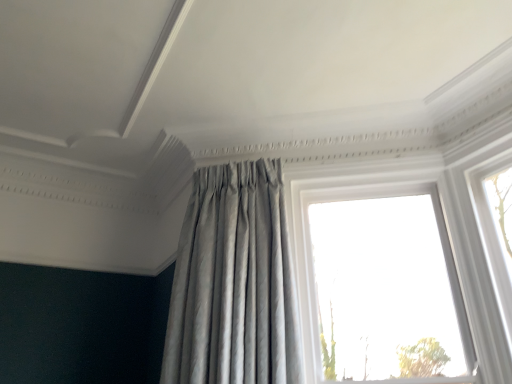
At what (x,y) coordinates should I click in order to perform the action: click on satin silver curtain at center. Please return your answer as a coordinate pair (x, y). The image size is (512, 384). Looking at the image, I should click on 234,283.

Describe the element at coordinates (234, 283) in the screenshot. I see `satin silver curtain at center` at that location.

The width and height of the screenshot is (512, 384). What do you see at coordinates (359, 273) in the screenshot?
I see `transparent glass window at upper right` at bounding box center [359, 273].

At what (x,y) coordinates should I click in order to perform the action: click on transparent glass window at upper right. Please return your answer as a coordinate pair (x, y). Looking at the image, I should click on (359, 273).

Where is `satin silver curtain at center`? The width and height of the screenshot is (512, 384). satin silver curtain at center is located at coordinates (234, 283).

Which is more to the right, transparent glass window at upper right or satin silver curtain at center?

transparent glass window at upper right.

Is transparent glass window at upper right positioned behind satin silver curtain at center?

Yes, transparent glass window at upper right is behind satin silver curtain at center.

Which is in front, point (403, 225) or point (208, 263)?

The point (208, 263) is in front.

From the image's perspective, which is above, transparent glass window at upper right or satin silver curtain at center?

satin silver curtain at center, from the image's perspective.

From a real-world perspective, is transparent glass window at upper right physically below satin silver curtain at center?

Yes, from a real-world perspective, transparent glass window at upper right is beneath satin silver curtain at center.

Between transparent glass window at upper right and satin silver curtain at center, which one has smaller width?

transparent glass window at upper right is thinner.

Considering the sizes of objects transparent glass window at upper right and satin silver curtain at center in the image provided, who is taller, transparent glass window at upper right or satin silver curtain at center?

Standing taller between the two is transparent glass window at upper right.

Can you confirm if transparent glass window at upper right is smaller than satin silver curtain at center?

Yes, transparent glass window at upper right is smaller than satin silver curtain at center.

Is satin silver curtain at center completely or partially inside transparent glass window at upper right?

Definitely not — satin silver curtain at center is not inside transparent glass window at upper right.

Would you consider transparent glass window at upper right to be distant from satin silver curtain at center?

No, transparent glass window at upper right is not far away from satin silver curtain at center.

Could you tell me if transparent glass window at upper right is facing satin silver curtain at center?

No, transparent glass window at upper right is not oriented towards satin silver curtain at center.

This screenshot has height=384, width=512. Find the location of `window lying on the right of satin silver curtain at center`. window lying on the right of satin silver curtain at center is located at coordinates (359, 273).

Which is more to the right, satin silver curtain at center or transparent glass window at upper right?

From the viewer's perspective, transparent glass window at upper right appears more on the right side.

Is satin silver curtain at center further to the viewer compared to transparent glass window at upper right?

No.

Is point (286, 280) closer to viewer compared to point (455, 334)?

Yes, it is.

Looking at this image, from the image's perspective, is satin silver curtain at center under transparent glass window at upper right?

No, from the image's perspective, satin silver curtain at center is not beneath transparent glass window at upper right.

From a real-world perspective, relative to transparent glass window at upper right, is satin silver curtain at center vertically above or below?

satin silver curtain at center is situated higher than transparent glass window at upper right in the real world.

Considering the sizes of objects satin silver curtain at center and transparent glass window at upper right in the image provided, who is thinner, satin silver curtain at center or transparent glass window at upper right?

Thinner between the two is transparent glass window at upper right.

Which of these two, satin silver curtain at center or transparent glass window at upper right, stands taller?

transparent glass window at upper right.

Does satin silver curtain at center have a smaller size compared to transparent glass window at upper right?

No, satin silver curtain at center is not smaller than transparent glass window at upper right.

Is transparent glass window at upper right located within satin silver curtain at center?

No, transparent glass window at upper right is not inside satin silver curtain at center.

Is satin silver curtain at center touching transparent glass window at upper right?

No, satin silver curtain at center is not with transparent glass window at upper right.

Is satin silver curtain at center oriented away from transparent glass window at upper right?

satin silver curtain at center does not have its back to transparent glass window at upper right.

How far apart are satin silver curtain at center and transparent glass window at upper right?

satin silver curtain at center is 19.34 inches away from transparent glass window at upper right.

The image size is (512, 384). What are the coordinates of `window located underneath the satin silver curtain at center (from a real-world perspective)` in the screenshot? It's located at (359, 273).

The image size is (512, 384). Find the location of `window behind the satin silver curtain at center`. window behind the satin silver curtain at center is located at coordinates 359,273.

At what (x,y) coordinates should I click in order to perform the action: click on curtain on the left of transparent glass window at upper right. Please return your answer as a coordinate pair (x, y). Looking at the image, I should click on (234, 283).